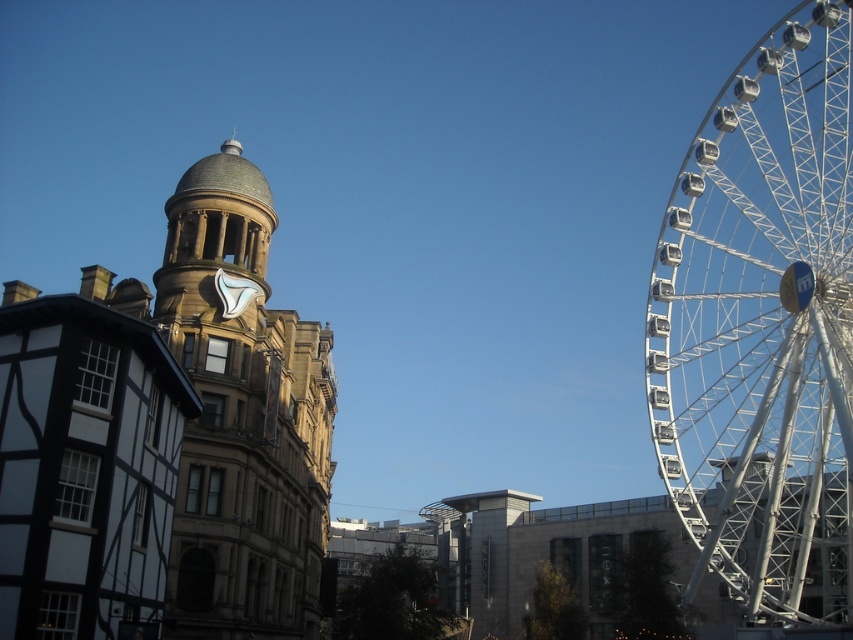
Question: Which point is closer to the camera taking this photo?

Choices:
 (A) (717, 285)
 (B) (195, 168)

Answer: (B)

Question: Does white metallic ferris wheel at right have a smaller size compared to brown stone clock tower at center?

Choices:
 (A) yes
 (B) no

Answer: (B)

Question: Is white metallic ferris wheel at right to the left of brown stone clock tower at center from the viewer's perspective?

Choices:
 (A) no
 (B) yes

Answer: (A)

Question: Does white metallic ferris wheel at right appear on the left side of brown stone clock tower at center?

Choices:
 (A) yes
 (B) no

Answer: (B)